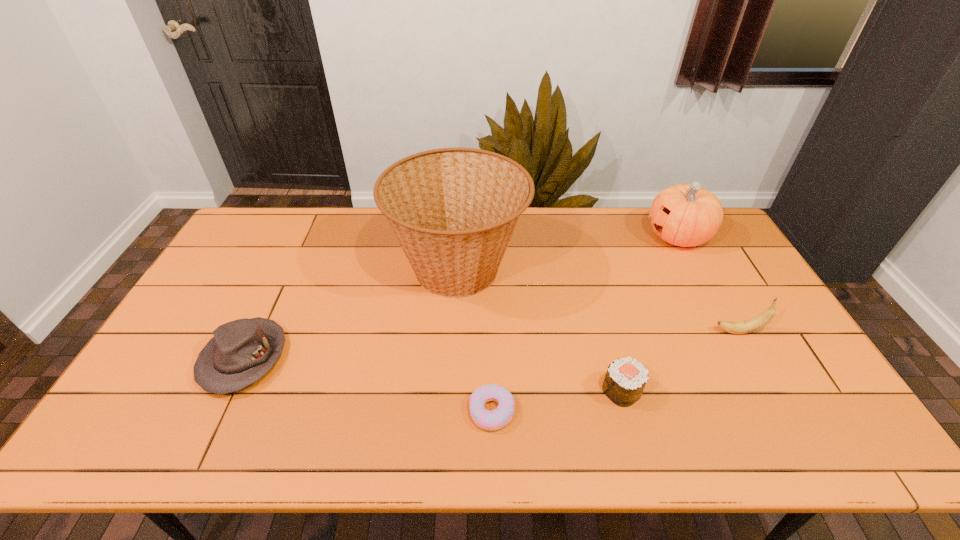
At what (x,y) coordinates should I click in order to perform the action: click on the tallest object. Please return your answer as a coordinate pair (x, y). This screenshot has width=960, height=540. Looking at the image, I should click on (453, 211).

What are the coordinates of `pumpkin` in the screenshot? It's located at (684, 215).

Where is `the fourth shortest object`? the fourth shortest object is located at coordinates 764,318.

At what (x,y) coordinates should I click in order to perform the action: click on hat. Please return your answer as a coordinate pair (x, y). The height and width of the screenshot is (540, 960). Looking at the image, I should click on (242, 351).

Where is `sushi`? The width and height of the screenshot is (960, 540). sushi is located at coordinates (625, 379).

I want to click on the shortest object, so click(x=492, y=420).

Where is `vacant space located on the left of the basket`? This screenshot has height=540, width=960. vacant space located on the left of the basket is located at coordinates (268, 269).

This screenshot has width=960, height=540. I want to click on free location located on the front-facing side of the second tallest object, so click(601, 236).

Identify the location of vacant region located on the front-facing side of the second tallest object. The height and width of the screenshot is (540, 960). (562, 236).

Where is `vacant region located on the front-facing side of the second tallest object`? vacant region located on the front-facing side of the second tallest object is located at coordinates (604, 236).